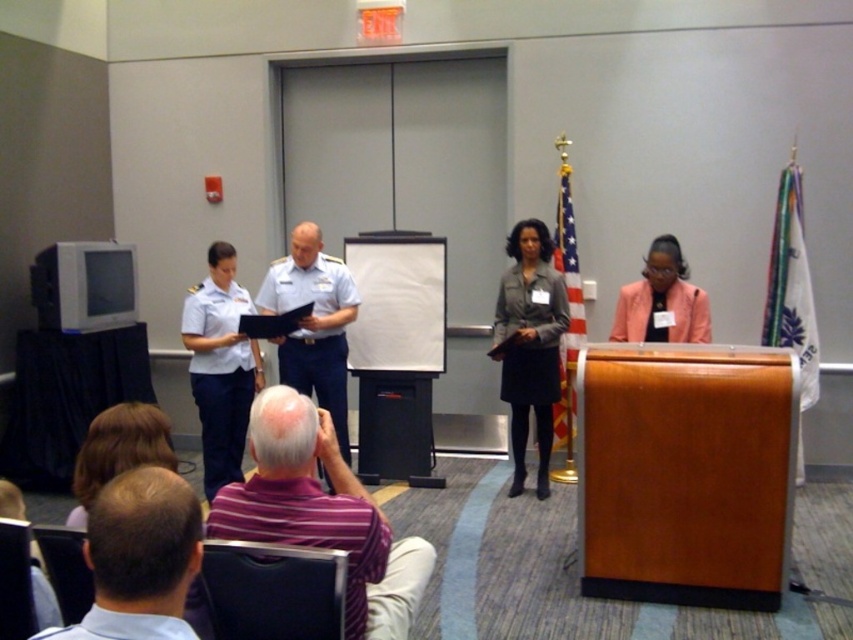
In the conference room scene, there is a person with light brown hair at lower left. What are their coordinates in the room?

The light brown hair at lower left is located at coordinates point (138, 557).

You are an event planner organizing a photo shoot in the conference room. You need to position a spotlight to highlight both the light brown hair at lower left and the white fabric uniform at center. Based on their positions, which object should the spotlight be angled downward from?

The spotlight should be angled downward from the white fabric uniform at center because the light brown hair at lower left is below it.